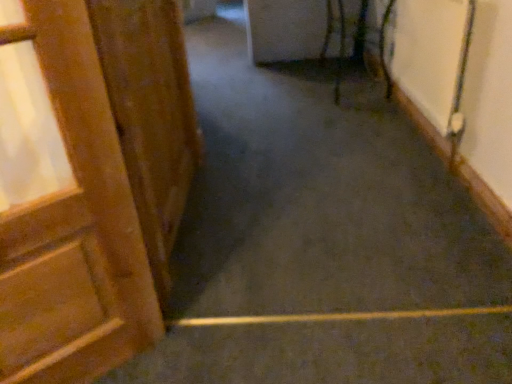
This screenshot has height=384, width=512. Describe the element at coordinates (151, 114) in the screenshot. I see `wooden door at left` at that location.

The height and width of the screenshot is (384, 512). What are the coordinates of `wooden door at left` in the screenshot? It's located at (151, 114).

This screenshot has width=512, height=384. What are the coordinates of `wooden door at left` in the screenshot? It's located at (151, 114).